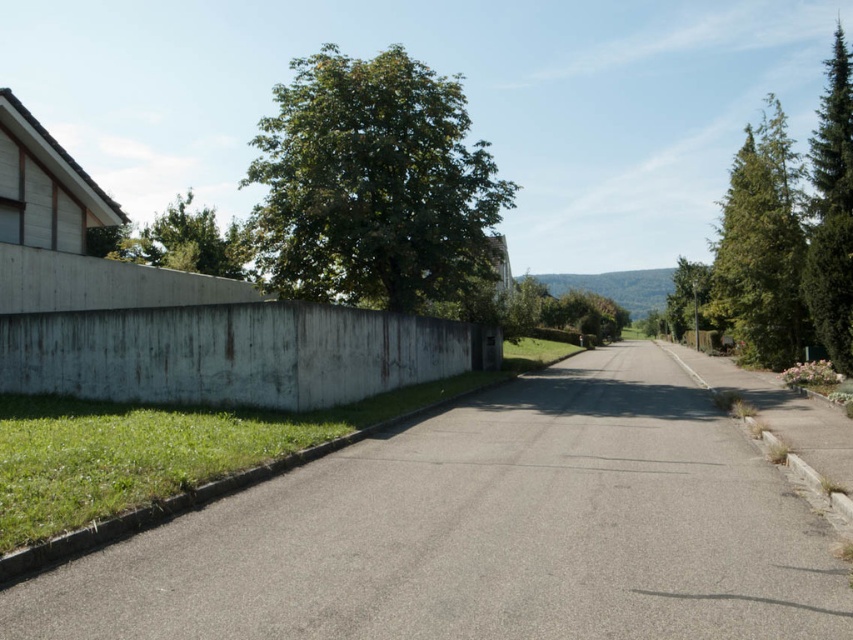
Between green textured tree at right and green coniferous tree at right, which one has less height?

green coniferous tree at right

Which is behind, point (820, 246) or point (845, 44)?

The point (845, 44) is more distant.

Who is more distant from viewer, (734, 163) or (822, 115)?

The point (822, 115) is behind.

Image resolution: width=853 pixels, height=640 pixels. Identify the location of green textured tree at right. (790, 234).

Does green coniferous tree at right come in front of green leafy tree at upper left?

Yes, it is.

Who is shorter, green coniferous tree at right or green leafy tree at upper left?

Standing shorter between the two is green leafy tree at upper left.

Find the location of a particular element. The image size is (853, 640). green coniferous tree at right is located at coordinates (833, 212).

Is gray asphalt driveway at center to the left of green textured tree at right from the viewer's perspective?

Yes, gray asphalt driveway at center is to the left of green textured tree at right.

You are a GUI agent. You are given a task and a screenshot of the screen. Output one action in this format:
    pyautogui.click(x=<x>, y=<y>)
    Task: Click on the gray asphalt driveway at center
    Image resolution: width=853 pixels, height=640 pixels.
    Given the screenshot: What is the action you would take?
    pyautogui.click(x=485, y=532)

Locate an element on the screen. gray asphalt driveway at center is located at coordinates (485, 532).